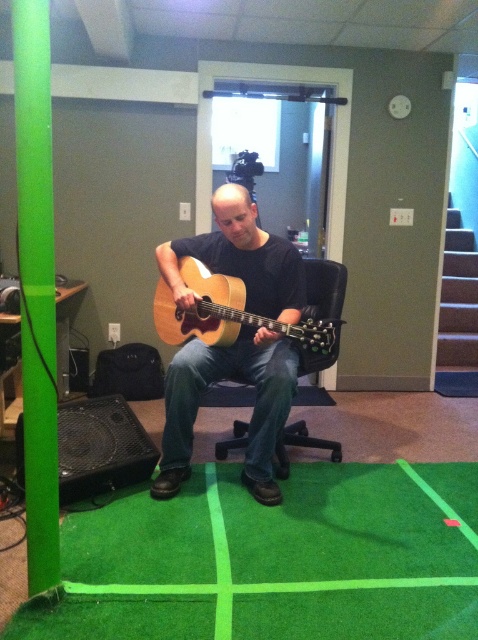
Does wooden acoustic guitar at center appear over black plastic swivel chair at center?

Indeed, wooden acoustic guitar at center is positioned over black plastic swivel chair at center.

Who is lower down, wooden acoustic guitar at center or black plastic swivel chair at center?

Positioned lower is black plastic swivel chair at center.

Where is `wooden acoustic guitar at center`? The height and width of the screenshot is (640, 478). wooden acoustic guitar at center is located at coordinates (252, 410).

At what (x,y) coordinates should I click in order to perform the action: click on wooden acoustic guitar at center. Please return your answer as a coordinate pair (x, y). Looking at the image, I should click on (252, 410).

Does wooden acoustic guitar at center have a greater width compared to light brown acoustic guitar at center?

No.

Between point (243, 368) and point (293, 337), which one is positioned in front?

Point (293, 337)

Where is `wooden acoustic guitar at center`? The image size is (478, 640). wooden acoustic guitar at center is located at coordinates (252, 410).

Can you confirm if light brown acoustic guitar at center is positioned to the left of black plastic swivel chair at center?

Correct, you'll find light brown acoustic guitar at center to the left of black plastic swivel chair at center.

Can you confirm if light brown acoustic guitar at center is bigger than black plastic swivel chair at center?

Yes.

Find the location of `light brown acoustic guitar at center`. light brown acoustic guitar at center is located at coordinates (237, 316).